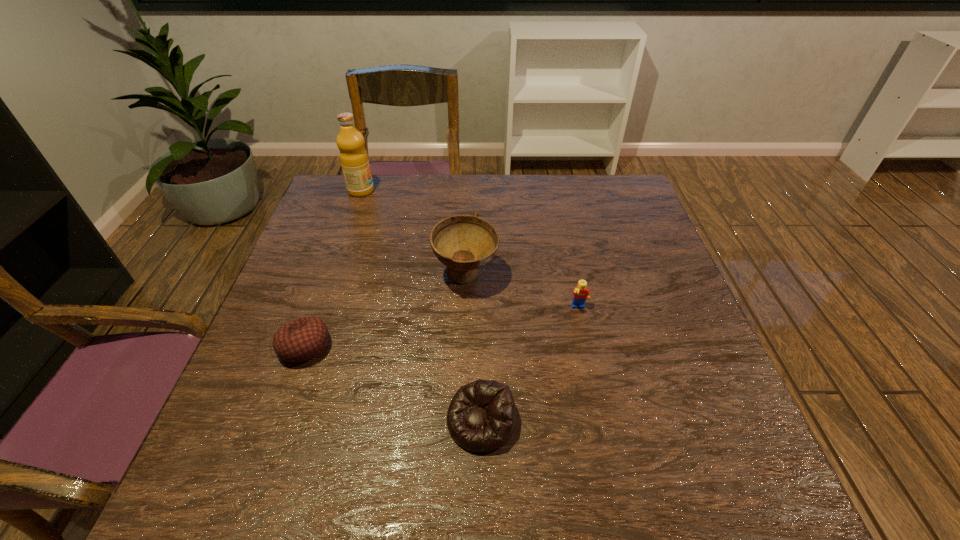
This screenshot has width=960, height=540. I want to click on free point located on the front label of the tallest object, so coord(468,191).

Locate an element on the screen. Image resolution: width=960 pixels, height=540 pixels. free space located 0.210m on the left of the second tallest object is located at coordinates (351, 276).

The width and height of the screenshot is (960, 540). Identify the location of vacant space located 0.080m on the face of the third farthest object. (586, 341).

Where is `free region located on the back of the fourth farthest object`? free region located on the back of the fourth farthest object is located at coordinates coord(346,231).

Image resolution: width=960 pixels, height=540 pixels. Identify the location of free space located 0.190m on the right of the nearest object. (615, 421).

The image size is (960, 540). I want to click on object that is positioned at the far edge, so click(354, 160).

Locate an element on the screen. The height and width of the screenshot is (540, 960). object at the near edge is located at coordinates (481, 417).

Locate an element on the screen. fruit juice positioned at the left edge is located at coordinates tap(354, 160).

In order to click on beanbag present at the left edge in this screenshot , I will do `click(303, 339)`.

This screenshot has height=540, width=960. I want to click on object present at the far left corner, so click(x=354, y=160).